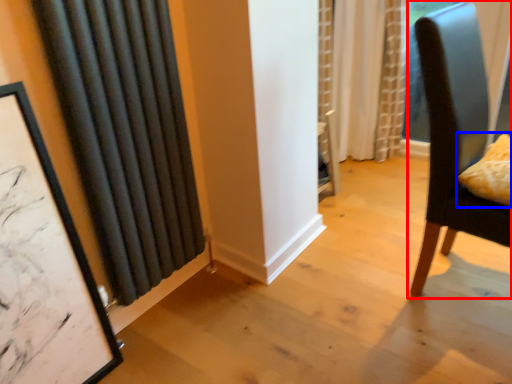
Question: Which object appears closest to the camera in this image, chair (highlighted by a red box) or pillow (highlighted by a blue box)?

Choices:
 (A) chair
 (B) pillow

Answer: (A)